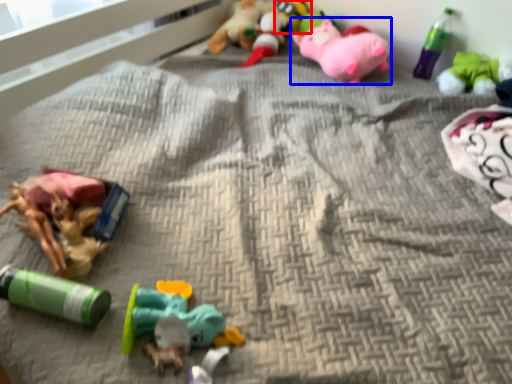
Question: Which point is further to the camera, toy (highlighted by a red box) or toy (highlighted by a blue box)?

Choices:
 (A) toy
 (B) toy

Answer: (A)